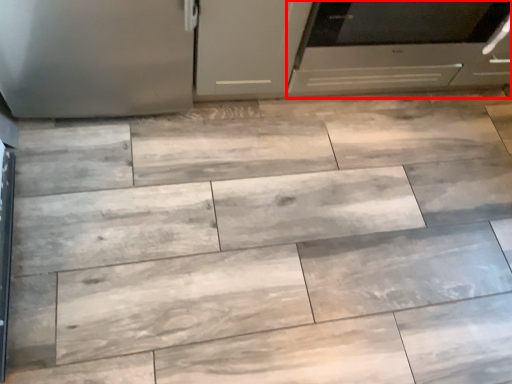
Question: Considering the relative positions of oven (annotated by the red box) and cabinetry in the image provided, where is oven (annotated by the red box) located with respect to the staircase?

Choices:
 (A) left
 (B) right

Answer: (B)